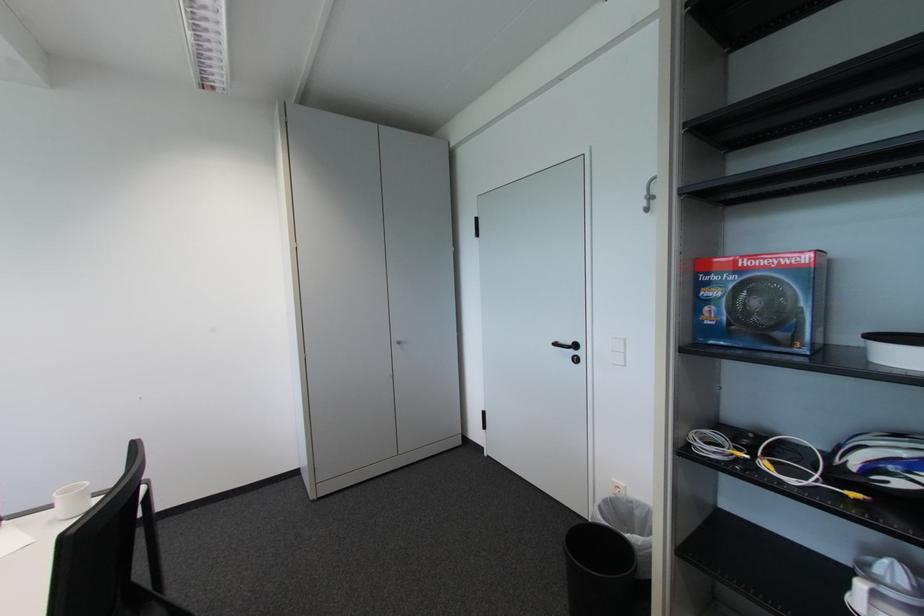
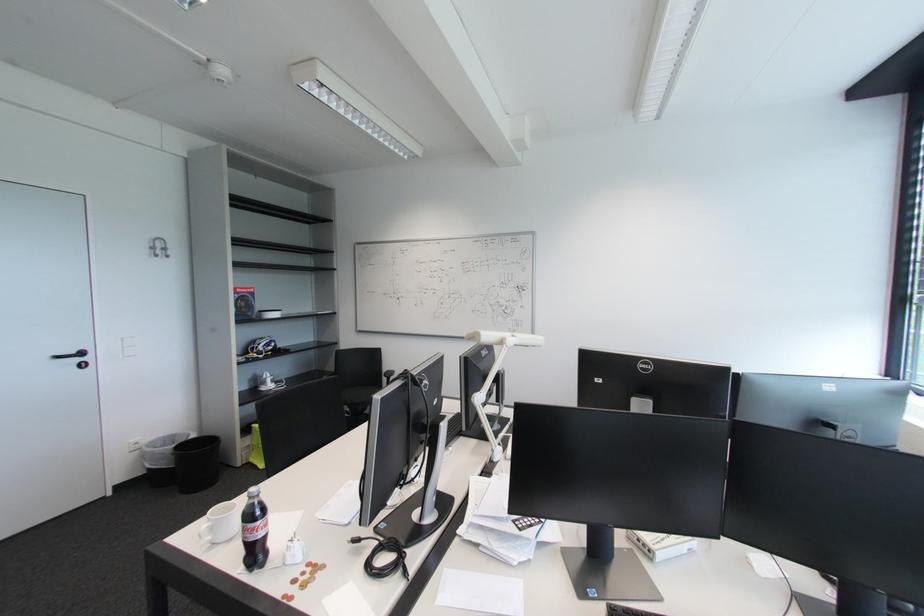
Locate, in the second image, the point that corresponds to the point at 578,353 in the first image.

(83, 361)